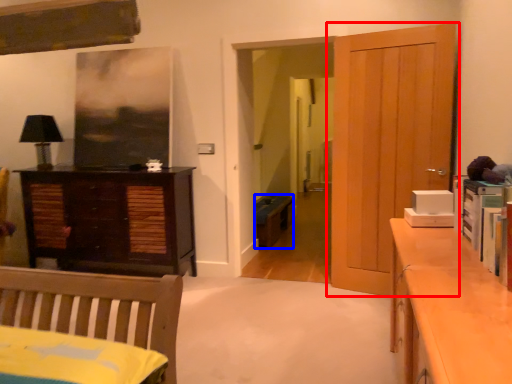
Question: Which point is closer to the camera, door (highlighted by a red box) or cabinetry (highlighted by a blue box)?

Choices:
 (A) door
 (B) cabinetry

Answer: (A)